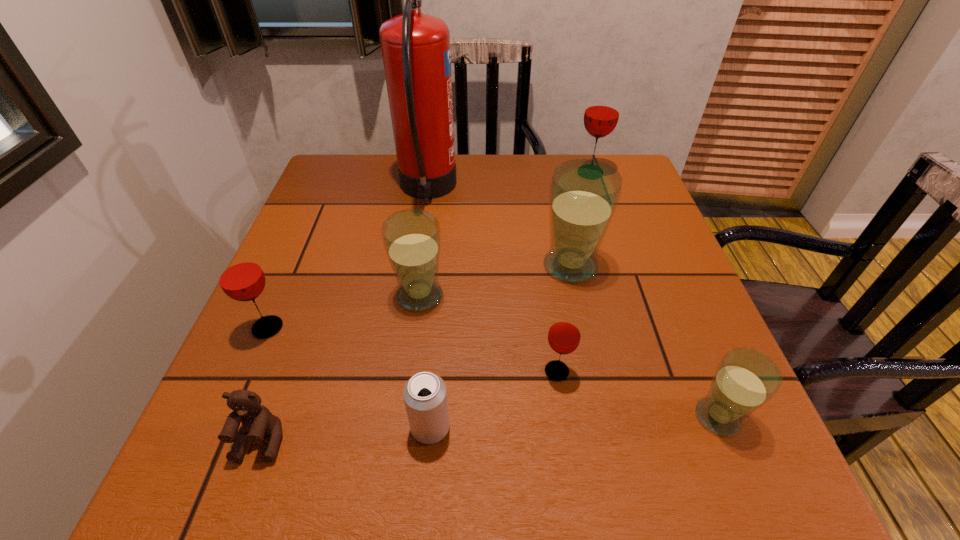
Identify the location of fire extinguisher. The width and height of the screenshot is (960, 540). (415, 47).

This screenshot has width=960, height=540. Find the location of `red fire extinguisher`. red fire extinguisher is located at coordinates (415, 47).

Find the location of a particular element. the biggest red glass is located at coordinates (602, 111).

Where is `the rightmost red glass`? the rightmost red glass is located at coordinates (602, 111).

What are the coordinates of `the biggest blue glass` in the screenshot? It's located at (584, 194).

Locate an element on the screen. The height and width of the screenshot is (540, 960). the leftmost blue glass is located at coordinates (411, 237).

I want to click on the second smallest blue glass, so click(x=411, y=237).

Where is `the second smallest red glass`? This screenshot has width=960, height=540. the second smallest red glass is located at coordinates (240, 276).

You are a GUI agent. You are given a task and a screenshot of the screen. Output one action in this format:
    pyautogui.click(x=<x>, y=<y>)
    Task: Click on the second farthest red glass
    This screenshot has width=960, height=540.
    Given the screenshot: What is the action you would take?
    pyautogui.click(x=240, y=276)

Where is `the smallest red glass`? The image size is (960, 540). the smallest red glass is located at coordinates (564, 335).